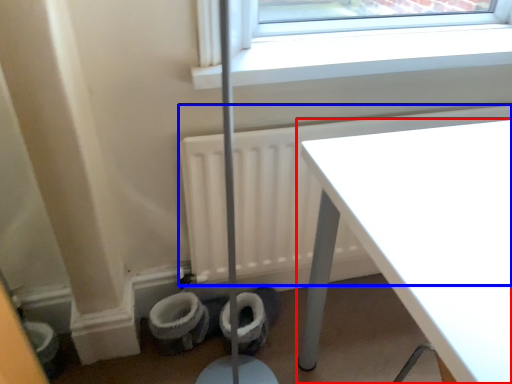
Question: Which object is further to the camera taking this photo, table (highlighted by a red box) or radiator (highlighted by a blue box)?

Choices:
 (A) table
 (B) radiator

Answer: (B)